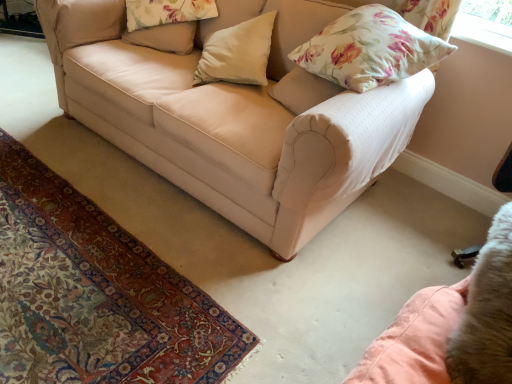
You are a GUI agent. You are given a task and a screenshot of the screen. Output one action in this format:
    pyautogui.click(x=<x>, y=<y>)
    Task: Click on the free space above beige fabric pillow at upper center, positioned as the 3th pillow in right-to-left order (from a real-world perspective)
    This screenshot has width=512, height=384.
    Given the screenshot: What is the action you would take?
    pyautogui.click(x=158, y=16)